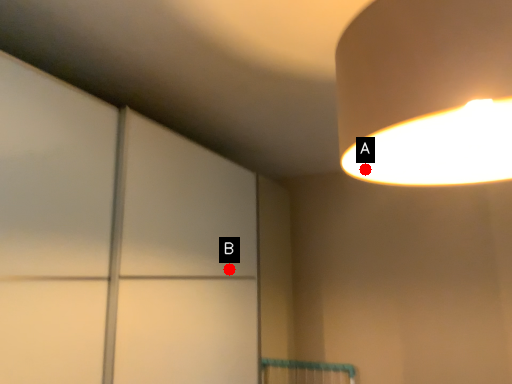
Question: Two points are circled on the image, labeled by A and B beside each circle. Which point is farther from the camera taking this photo?

Choices:
 (A) A is further
 (B) B is further

Answer: (B)